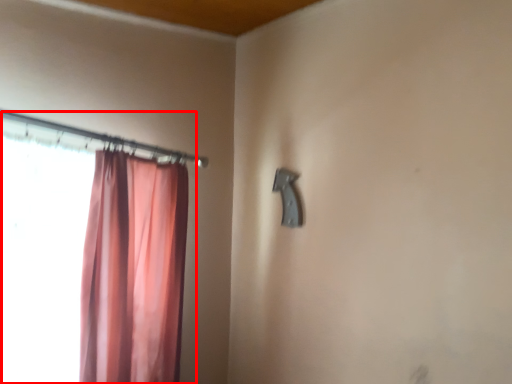
Question: Observing the image, what is the correct spatial positioning of curtain (annotated by the red box) in reference to door handle?

Choices:
 (A) left
 (B) right

Answer: (A)